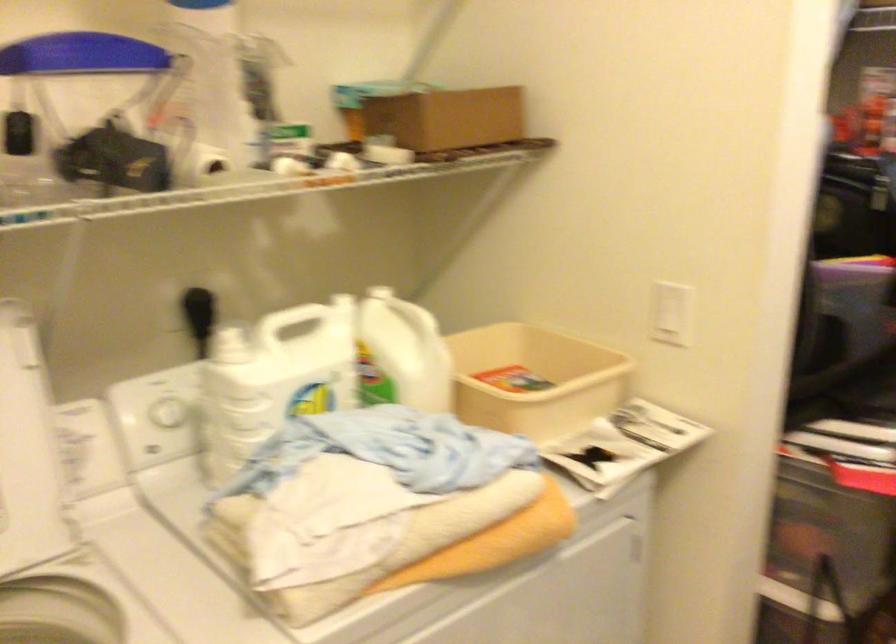
What do you see at coordinates (375, 301) in the screenshot?
I see `the detergent jug handle` at bounding box center [375, 301].